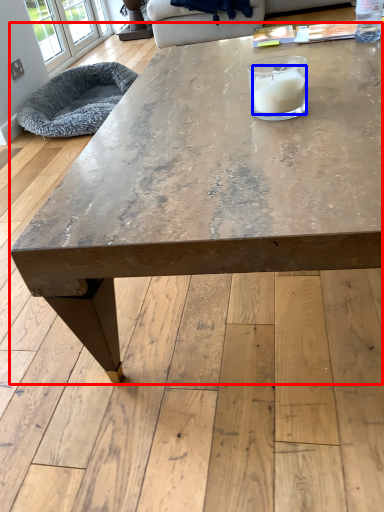
Question: Which object is closer to the camera taking this photo, coffee table (highlighted by a red box) or candle (highlighted by a blue box)?

Choices:
 (A) coffee table
 (B) candle

Answer: (A)